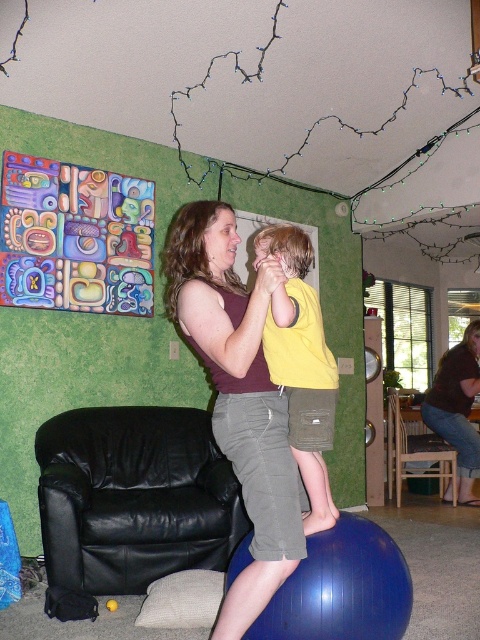
You are a fashion designer observing the image. You need to determine which clothing item has a bigger size between the matte purple tank top at center and the yellow matte shirt at center. Which one is larger?

The matte purple tank top at center is larger in size than the yellow matte shirt at center.

You are organizing a clothing display in the living room and have two shirts to place on the exercise ball. The yellow matte shirt at center and the matte brown shirt at center. Which shirt should you choose if you want to use the least amount of space on the exercise ball?

The yellow matte shirt at center occupies less space than the matte brown shirt at center, so you should choose the yellow matte shirt at center to use the least amount of space on the exercise ball.

You are a delivery person who needs to place a small package between the matte brown shirt at center and the brown wooden chair at lower right. Can you fit it there?

The distance between the matte brown shirt at center and the brown wooden chair at lower right is 32.35 centimeters, so yes, the package can be placed there as the space is sufficient.